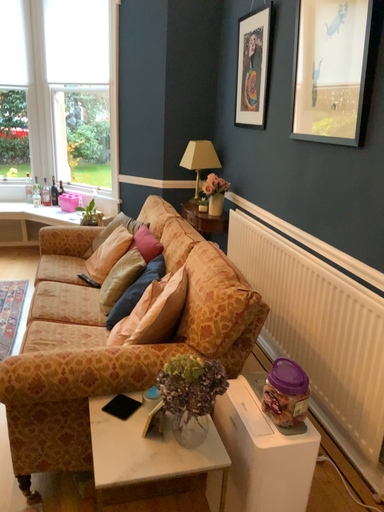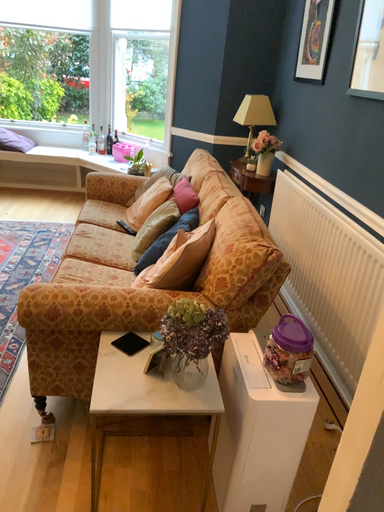
Question: How did the camera likely rotate when shooting the video?

Choices:
 (A) rotated left
 (B) rotated right

Answer: (A)